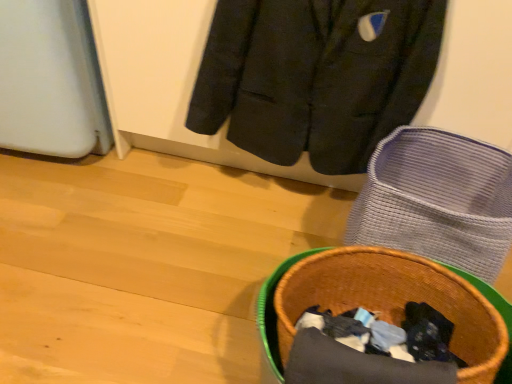
Question: Is woven fabric basket at lower right closer to the viewer compared to dark gray wool jacket at upper center?

Choices:
 (A) no
 (B) yes

Answer: (B)

Question: Can you confirm if woven fabric basket at lower right is smaller than dark gray wool jacket at upper center?

Choices:
 (A) yes
 (B) no

Answer: (B)

Question: Is woven fabric basket at lower right not close to dark gray wool jacket at upper center?

Choices:
 (A) no
 (B) yes

Answer: (A)

Question: Considering the relative sizes of woven fabric basket at lower right and dark gray wool jacket at upper center in the image provided, is woven fabric basket at lower right bigger than dark gray wool jacket at upper center?

Choices:
 (A) yes
 (B) no

Answer: (A)

Question: From the image's perspective, would you say woven fabric basket at lower right is shown under dark gray wool jacket at upper center?

Choices:
 (A) yes
 (B) no

Answer: (A)

Question: Could you tell me if woven fabric basket at lower right is facing dark gray wool jacket at upper center?

Choices:
 (A) yes
 (B) no

Answer: (B)

Question: Is woven fabric basket at lower right positioned behind brown woven basket at lower right?

Choices:
 (A) yes
 (B) no

Answer: (A)

Question: Considering the relative sizes of woven fabric basket at lower right and brown woven basket at lower right in the image provided, is woven fabric basket at lower right bigger than brown woven basket at lower right?

Choices:
 (A) yes
 (B) no

Answer: (B)

Question: Is woven fabric basket at lower right taller than brown woven basket at lower right?

Choices:
 (A) yes
 (B) no

Answer: (A)

Question: Does woven fabric basket at lower right contain brown woven basket at lower right?

Choices:
 (A) yes
 (B) no

Answer: (B)

Question: From a real-world perspective, is woven fabric basket at lower right beneath brown woven basket at lower right?

Choices:
 (A) yes
 (B) no

Answer: (A)

Question: Is woven fabric basket at lower right smaller than brown woven basket at lower right?

Choices:
 (A) yes
 (B) no

Answer: (A)

Question: Is brown woven basket at lower right bigger than dark gray wool jacket at upper center?

Choices:
 (A) no
 (B) yes

Answer: (B)